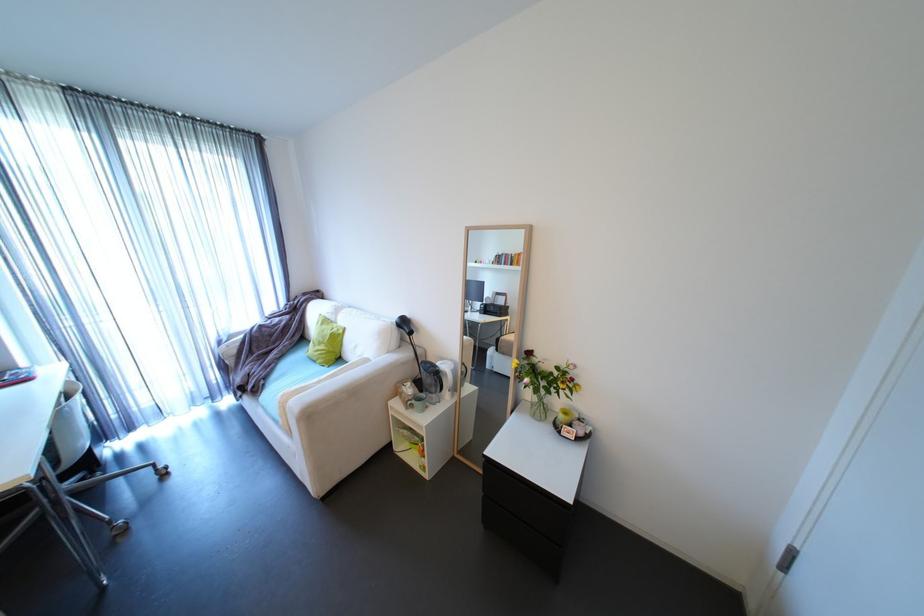
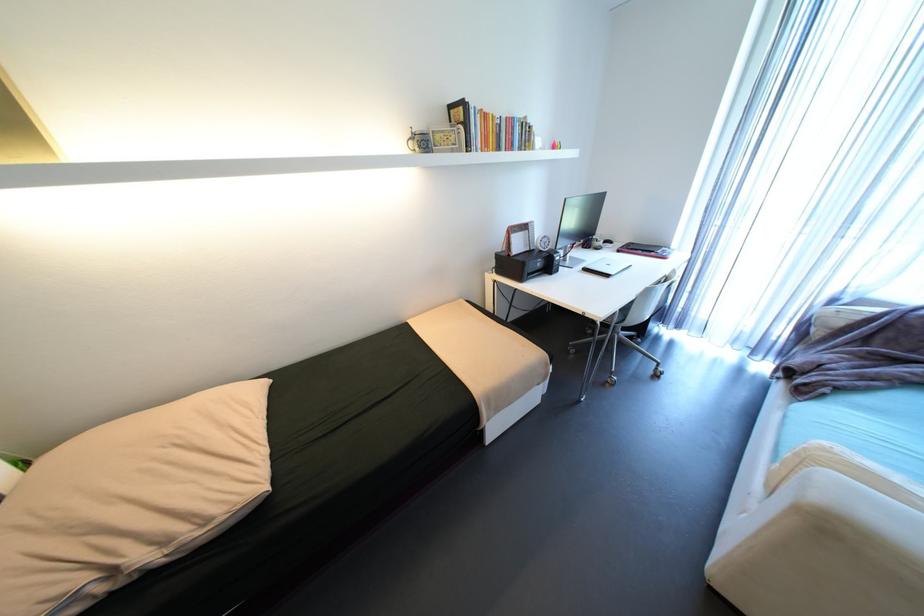
Based on the continuous images, in which direction is the camera rotating?

The rotation direction of the camera is left-down.